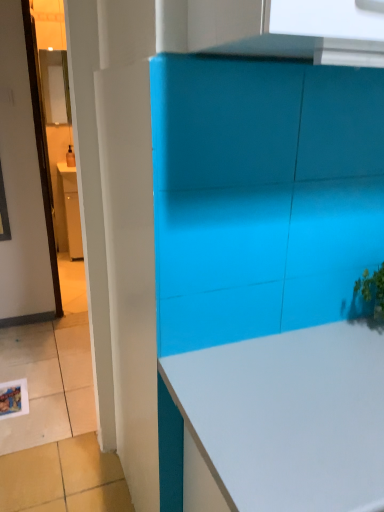
The image size is (384, 512). Identify the location of free space above white glossy countertop at lower right (from a real-world perspective). (314, 386).